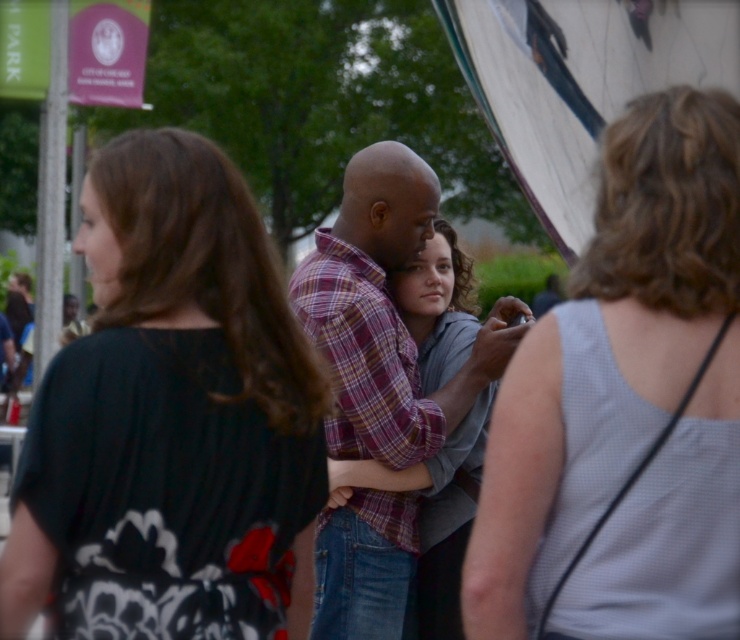
You are standing at the camera position. There are two points marked in the image. The first point is at coordinates point [138,577] and the second point is at point [542,436]. Which point is closer to you?

Point [542,436] is closer to you because it is in front of point [138,577].

Looking at this image, you are organizing a clothing donation drive and need to categorize the plaid shirt at center and the plaid cotton shirt at center based on their sizes. According to the image, which one should be placed in the small size bin?

The plaid shirt at center should be placed in the small size bin because it is smaller than the plaid cotton shirt at center.

You are organizing a clothing display and need to arrange the black matte dress at center and the gray dotted tank top at right side by side. Based on their widths, which one should be placed first to maximize space efficiency?

The black matte dress at center might be wider than gray dotted tank top at right, so placing the tank top first would allow more space for the wider dress afterward.